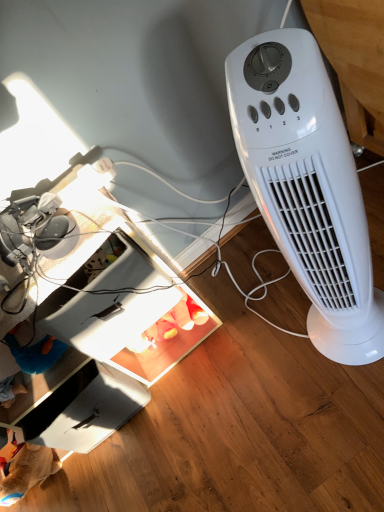
Question: Can you confirm if white plastic heater at right is wider than white cardboard drawer at lower left?

Choices:
 (A) yes
 (B) no

Answer: (B)

Question: Is white plastic heater at right outside of white cardboard drawer at lower left?

Choices:
 (A) no
 (B) yes

Answer: (B)

Question: Is white cardboard drawer at lower left completely or partially inside white plastic heater at right?

Choices:
 (A) no
 (B) yes

Answer: (A)

Question: Can you see white plastic heater at right touching white cardboard drawer at lower left?

Choices:
 (A) no
 (B) yes

Answer: (A)

Question: From the image's perspective, is white plastic heater at right above white cardboard drawer at lower left?

Choices:
 (A) yes
 (B) no

Answer: (A)

Question: From a real-world perspective, is white cardboard drawer at lower left above or below white plastic heater at right?

Choices:
 (A) above
 (B) below

Answer: (B)

Question: From the image's perspective, relative to white plastic heater at right, is white cardboard drawer at lower left above or below?

Choices:
 (A) below
 (B) above

Answer: (A)

Question: Visually, is white cardboard drawer at lower left positioned to the left or to the right of white plastic heater at right?

Choices:
 (A) left
 (B) right

Answer: (A)

Question: Considering their positions, is white cardboard drawer at lower left located in front of or behind white plastic heater at right?

Choices:
 (A) front
 (B) behind

Answer: (B)

Question: In the image, is white cardboard drawer at lower left on the left side or the right side of white plastic computer desk at lower left?

Choices:
 (A) left
 (B) right

Answer: (B)

Question: From a real-world perspective, is white cardboard drawer at lower left above or below white plastic computer desk at lower left?

Choices:
 (A) above
 (B) below

Answer: (B)

Question: From their relative heights in the image, would you say white cardboard drawer at lower left is taller or shorter than white plastic computer desk at lower left?

Choices:
 (A) tall
 (B) short

Answer: (B)

Question: From the image's perspective, is white cardboard drawer at lower left located above or below white plastic computer desk at lower left?

Choices:
 (A) above
 (B) below

Answer: (B)

Question: From a real-world perspective, is white plastic heater at right physically located above or below white cardboard drawer at lower left?

Choices:
 (A) above
 (B) below

Answer: (A)

Question: Visually, is white plastic heater at right positioned to the left or to the right of white cardboard drawer at lower left?

Choices:
 (A) right
 (B) left

Answer: (A)